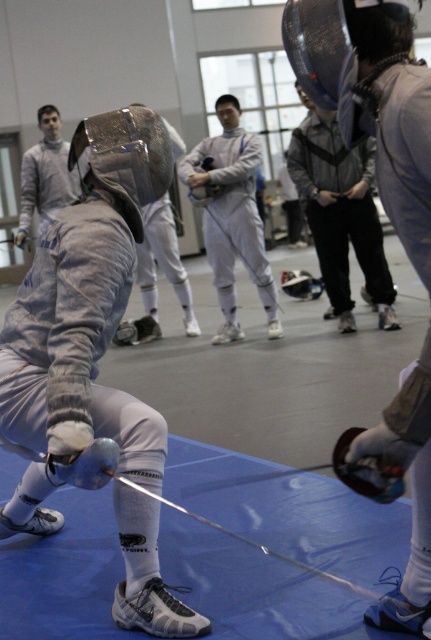
Based on the photo, you are a new fencer entering the gym and see the shiny silver helmet at center and the matte silver fencing mask at upper left. Which object is positioned to the right of the other?

The shiny silver helmet at center is positioned to the right of the matte silver fencing mask at upper left.

In the scene shown: You are a beginner fencer entering the gym and see the shiny silver helmet at center and the matte silver fencing mask at upper left. Which object is closer to you?

The shiny silver helmet at center is closer to you because it is in front of the matte silver fencing mask at upper left.